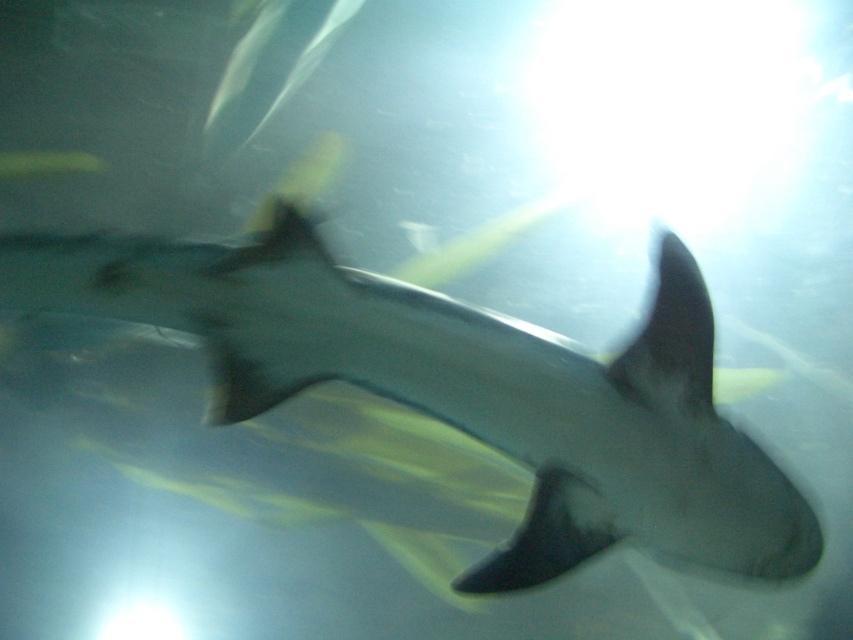
You are a photographer trying to capture the shark in the image. You notice two points in the scene at coordinates point [675,556] and point [643,360]. Which point is closer to your camera lens?

→ Point [643,360] is closer to the camera lens because it is less further than point [675,556].

You are a marine biologist observing the underwater scene. You notice the gray matte shark at center and the black matte fin at upper center. Which object is bigger in size?

The gray matte shark at center is larger in size than the black matte fin at upper center.